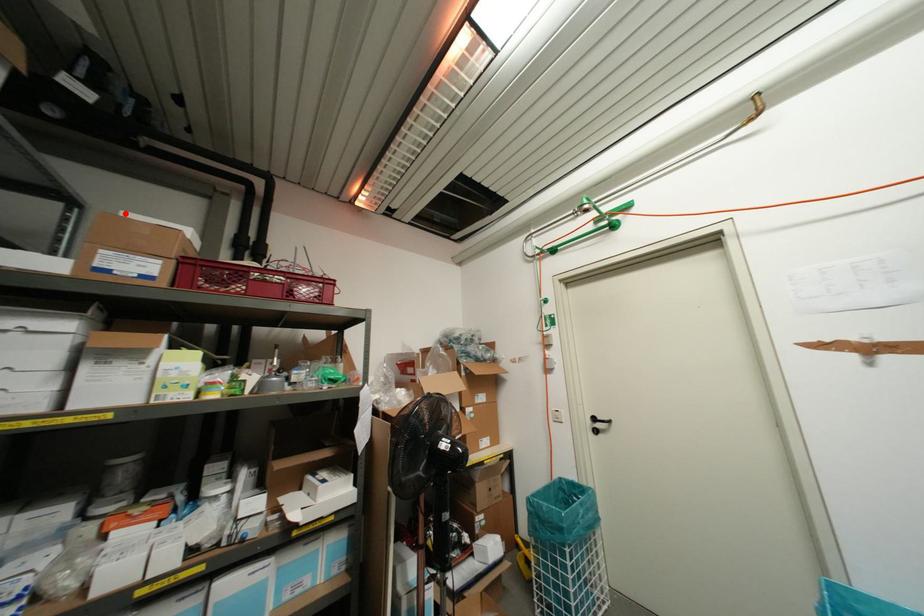
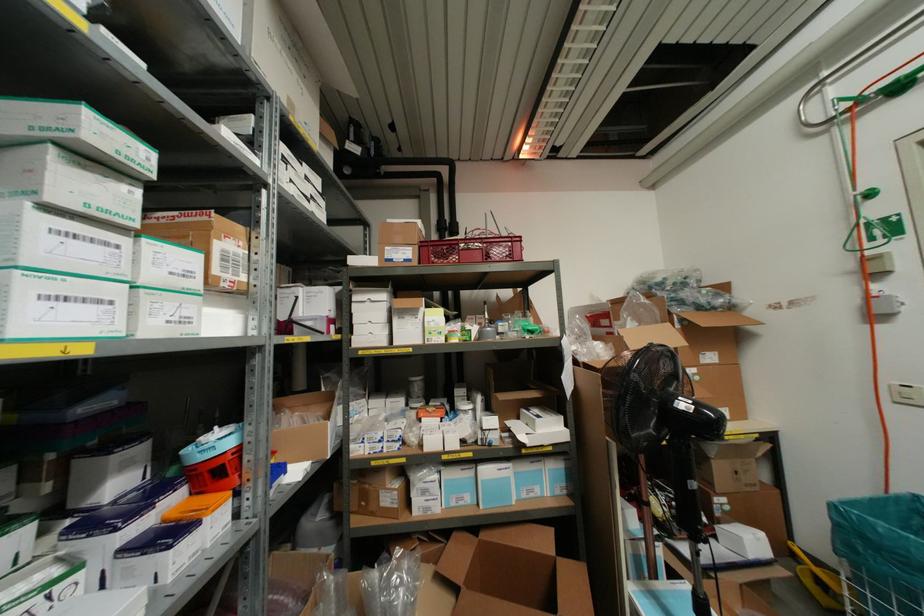
Locate, in the second image, the point that corresponds to the highlighted location in the first image.

(388, 220)